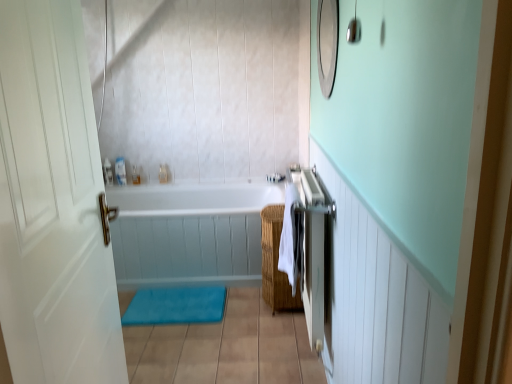
Find the location of a particular element. This screenshot has width=512, height=384. free spot above blue fabric bath mat at lower center (from a real-world perspective) is located at coordinates (176, 299).